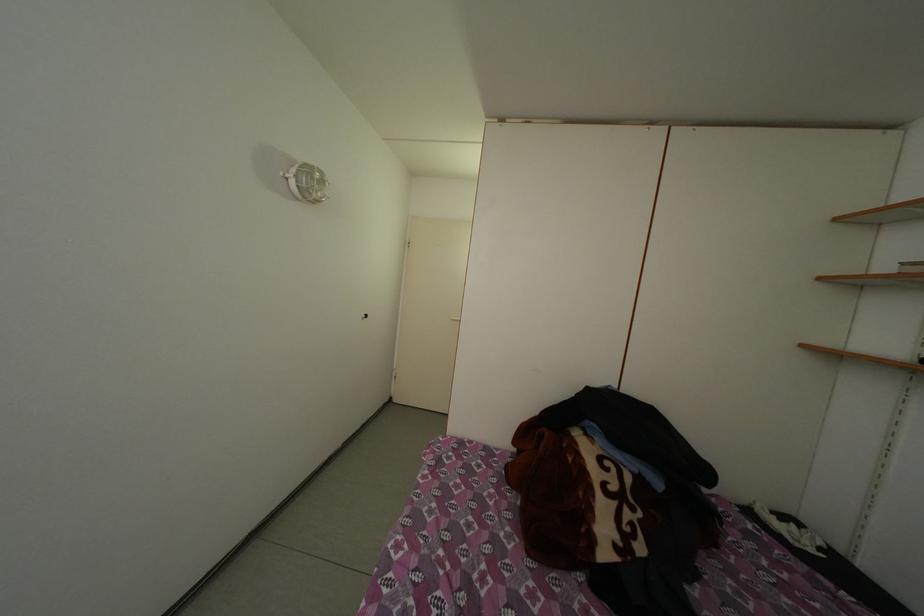
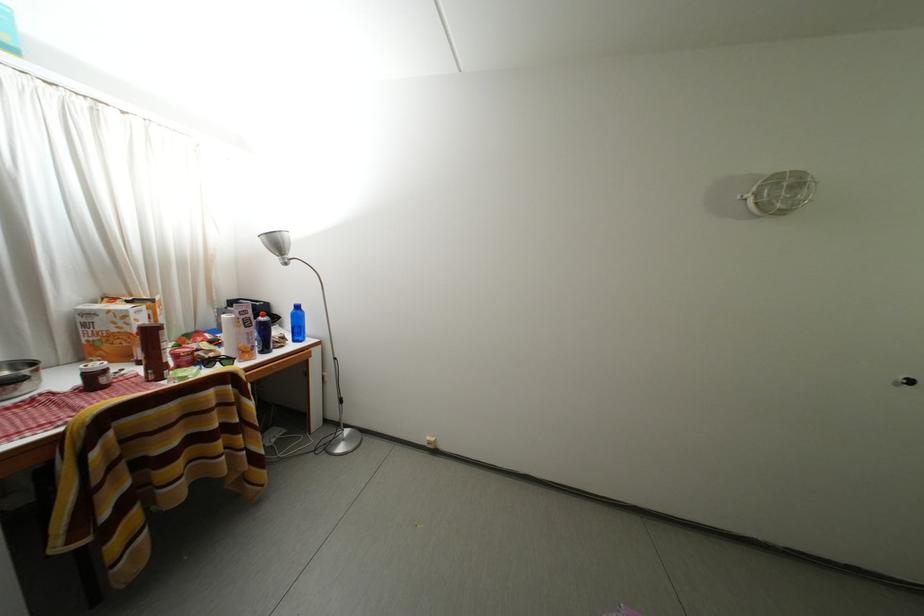
Question: The camera is either moving clockwise (left) or counter-clockwise (right) around the object. The first image is from the beginning of the video and the second image is from the end. Is the camera moving left or right when shooting the video?

Choices:
 (A) Left
 (B) Right

Answer: (B)